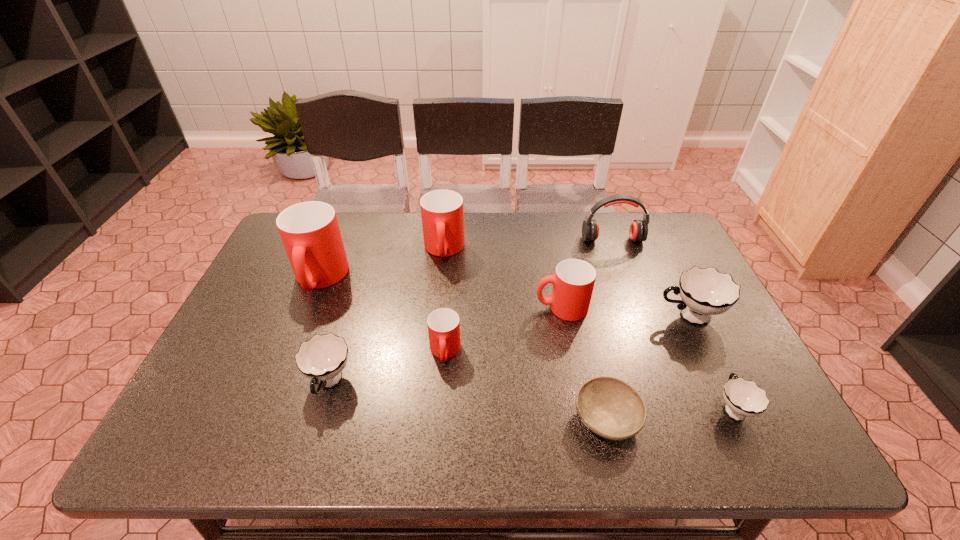
The height and width of the screenshot is (540, 960). In order to click on bowl that is at the near edge in this screenshot , I will do `click(609, 407)`.

Locate an element on the screen. Image resolution: width=960 pixels, height=540 pixels. object located in the left edge section of the desktop is located at coordinates (310, 233).

The image size is (960, 540). I want to click on earphone that is positioned at the right edge, so click(x=638, y=231).

Where is `object located in the far left corner section of the desktop`? Image resolution: width=960 pixels, height=540 pixels. object located in the far left corner section of the desktop is located at coordinates (310, 233).

Identify the location of object at the far right corner. (638, 231).

Find the location of a particular element. object that is at the near right corner is located at coordinates (743, 398).

In the image, there is a desktop. Identify the location of vacant space at the far edge. Image resolution: width=960 pixels, height=540 pixels. (611, 232).

Image resolution: width=960 pixels, height=540 pixels. Find the location of `free space at the near edge of the desktop`. free space at the near edge of the desktop is located at coordinates (398, 434).

Where is `free space at the far right corner of the desktop`? Image resolution: width=960 pixels, height=540 pixels. free space at the far right corner of the desktop is located at coordinates (667, 246).

Locate an element on the screen. The height and width of the screenshot is (540, 960). empty space between the gray bowl and the leftmost white cup is located at coordinates (468, 401).